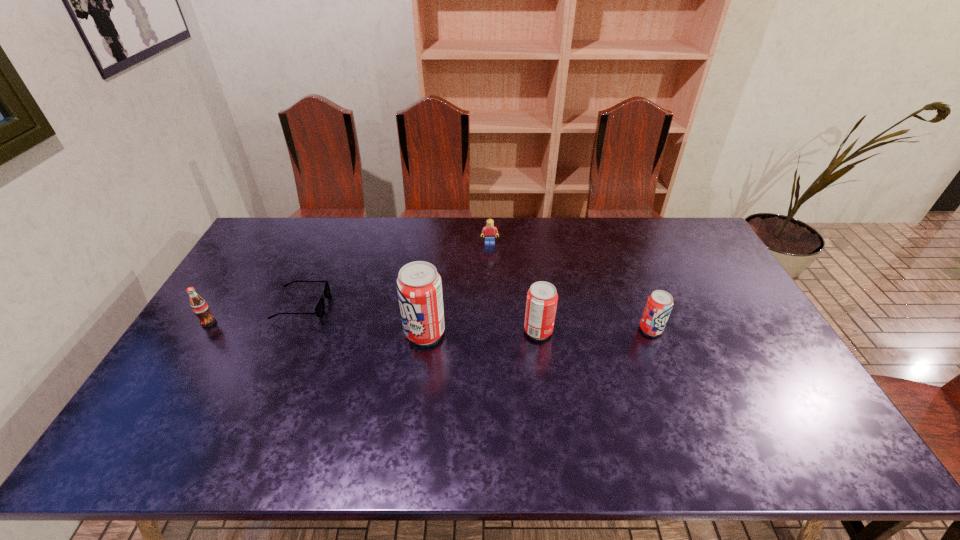
Locate an element on the screen. This screenshot has height=540, width=960. free space at the left edge of the desktop is located at coordinates (257, 273).

The image size is (960, 540). Find the location of `blank space at the right edge of the desktop`. blank space at the right edge of the desktop is located at coordinates (762, 338).

Where is `free space at the far right corner of the desktop`? free space at the far right corner of the desktop is located at coordinates (672, 240).

Locate an element on the screen. The height and width of the screenshot is (540, 960). free location at the near right corner is located at coordinates (802, 391).

Where is `empty space that is in between the leftmost object and the third object from right to left`? The width and height of the screenshot is (960, 540). empty space that is in between the leftmost object and the third object from right to left is located at coordinates (349, 283).

I want to click on free space between the spectacles and the leftmost object, so (x=255, y=314).

Identify the location of free point between the rightmost object and the spectacles. Image resolution: width=960 pixels, height=540 pixels. (476, 317).

Where is `vacant region between the rightmost soda and the second soda from right to left`? This screenshot has height=540, width=960. vacant region between the rightmost soda and the second soda from right to left is located at coordinates (594, 330).

Where is `free area in between the fourth object from left to right and the fifth object from right to left`? free area in between the fourth object from left to right and the fifth object from right to left is located at coordinates (396, 274).

Locate an element on the screen. free spot between the spectacles and the fourth object from left to right is located at coordinates (396, 274).